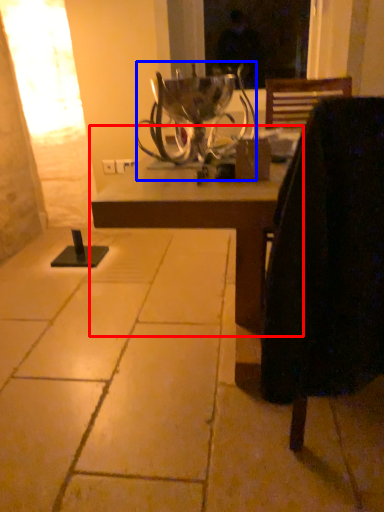
Question: Which point is closer to the camera, table (highlighted by a red box) or candle holder (highlighted by a blue box)?

Choices:
 (A) table
 (B) candle holder

Answer: (A)